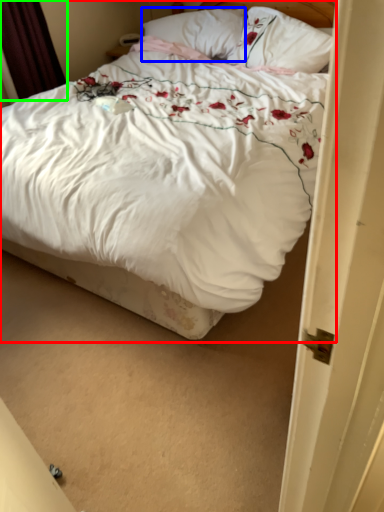
Question: Which object is the farthest from bed (highlighted by a red box)? Choose among these: pillow (highlighted by a blue box) or curtain (highlighted by a green box).

Choices:
 (A) pillow
 (B) curtain

Answer: (A)